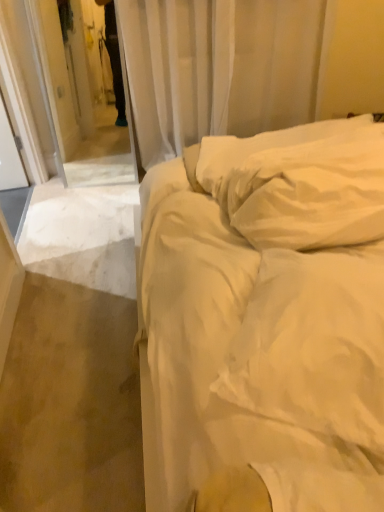
Question: Are white sheer curtain at upper center and white cotton bed at center making contact?

Choices:
 (A) no
 (B) yes

Answer: (A)

Question: Does white sheer curtain at upper center come behind white cotton bed at center?

Choices:
 (A) yes
 (B) no

Answer: (A)

Question: Does white sheer curtain at upper center have a greater width compared to white cotton bed at center?

Choices:
 (A) no
 (B) yes

Answer: (A)

Question: Is white sheer curtain at upper center outside of white cotton bed at center?

Choices:
 (A) yes
 (B) no

Answer: (A)

Question: Is white sheer curtain at upper center taller than white cotton bed at center?

Choices:
 (A) no
 (B) yes

Answer: (B)

Question: Is there a large distance between white sheer curtain at upper center and white cotton bed at center?

Choices:
 (A) no
 (B) yes

Answer: (B)

Question: Does white cotton bed at center turn towards white sheer curtain at upper center?

Choices:
 (A) yes
 (B) no

Answer: (B)

Question: Does white cotton bed at center have a lesser height compared to white sheer curtain at upper center?

Choices:
 (A) no
 (B) yes

Answer: (B)

Question: Can you confirm if white cotton bed at center is taller than white sheer curtain at upper center?

Choices:
 (A) yes
 (B) no

Answer: (B)

Question: From a real-world perspective, is white cotton bed at center over white sheer curtain at upper center?

Choices:
 (A) yes
 (B) no

Answer: (B)

Question: Considering the relative sizes of white cotton bed at center and white sheer curtain at upper center in the image provided, is white cotton bed at center wider than white sheer curtain at upper center?

Choices:
 (A) no
 (B) yes

Answer: (B)

Question: Can you confirm if white cotton bed at center is thinner than white sheer curtain at upper center?

Choices:
 (A) yes
 (B) no

Answer: (B)

Question: Is white cotton bed at center turned away from white soft pillow at upper right?

Choices:
 (A) no
 (B) yes

Answer: (A)